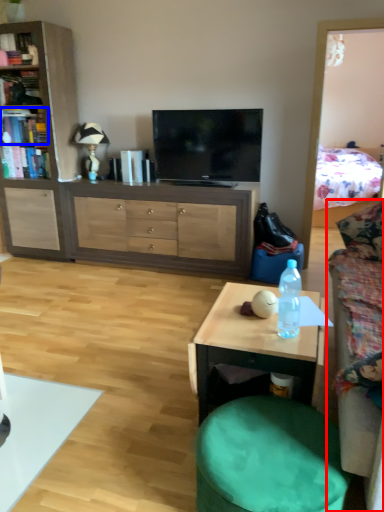
Question: Which object is further to the camera taking this photo, studio couch (highlighted by a red box) or book (highlighted by a blue box)?

Choices:
 (A) studio couch
 (B) book

Answer: (B)